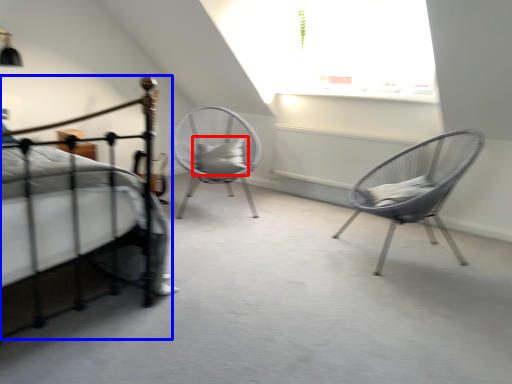
Question: Which of the following is the closest to the observer, pillow (highlighted by a red box) or bed (highlighted by a blue box)?

Choices:
 (A) pillow
 (B) bed

Answer: (B)